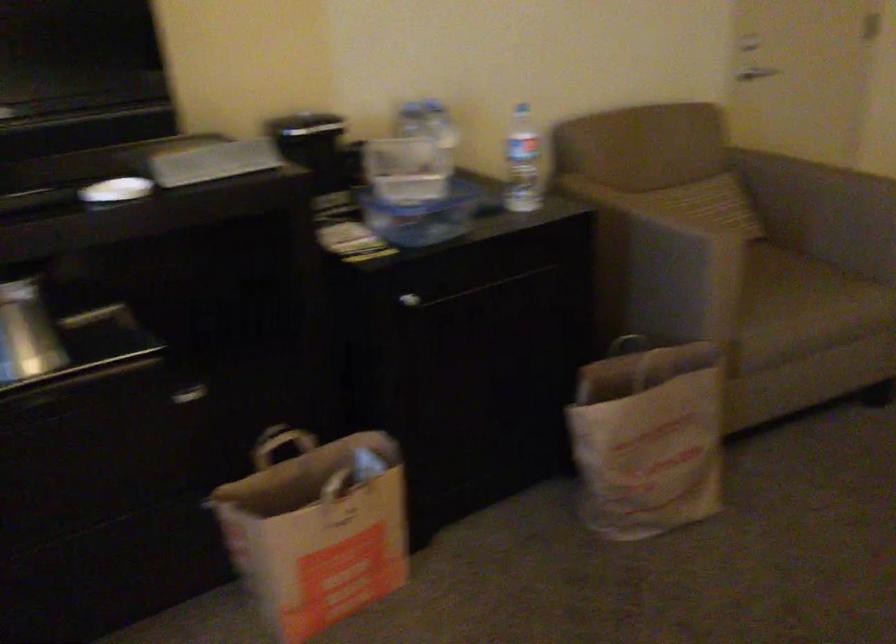
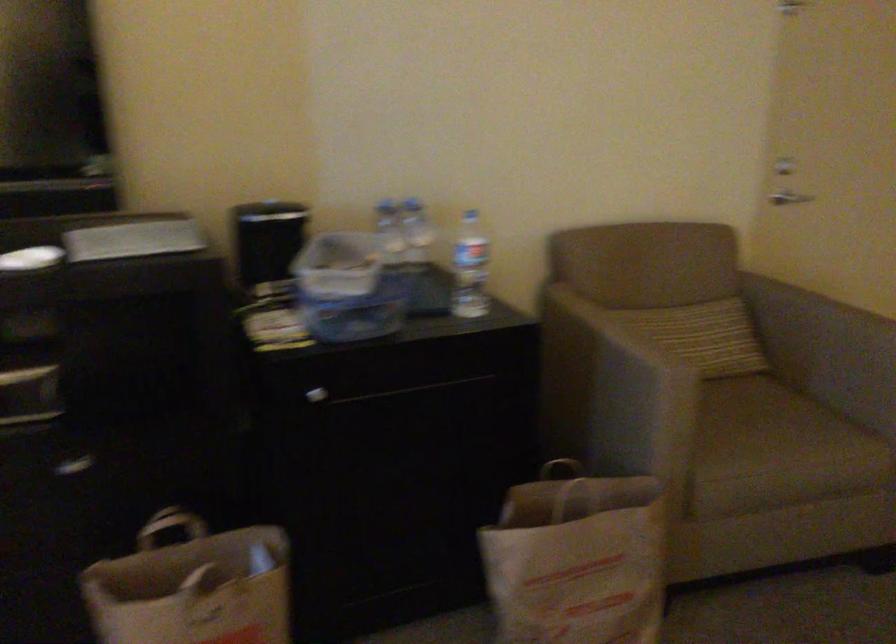
The point at (x=421, y=192) is marked in the first image. Where is the corresponding point in the second image?

(348, 288)